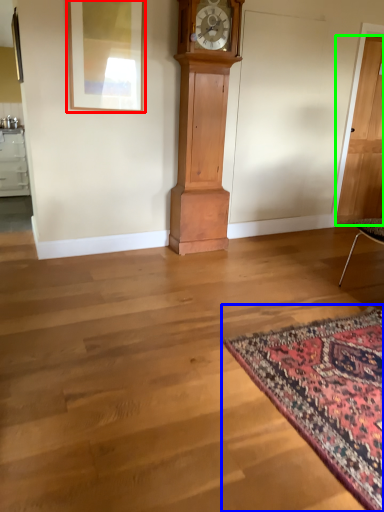
Question: Which object is positioned closest to picture frame (highlighted by a red box)? Select from mat (highlighted by a blue box) and door (highlighted by a green box).

Choices:
 (A) mat
 (B) door

Answer: (A)